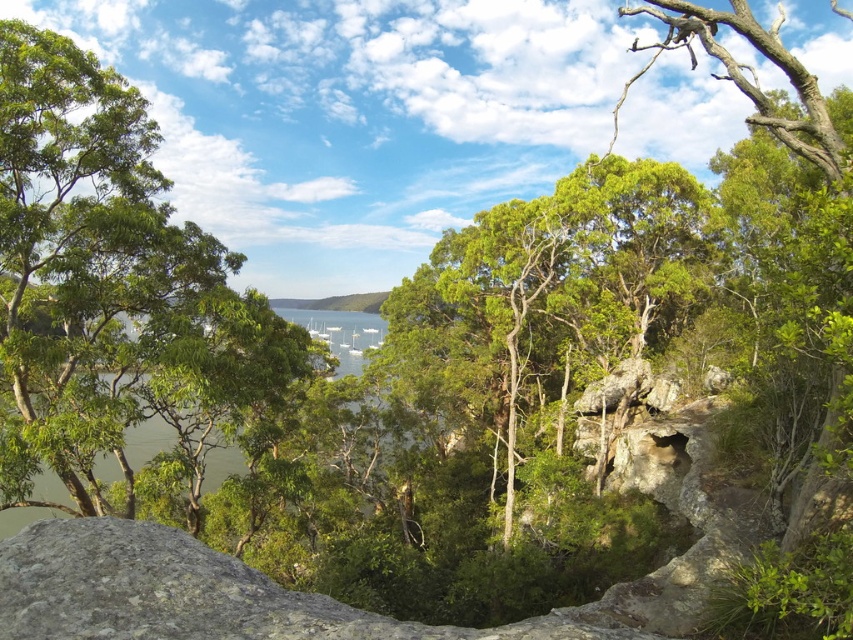
You are standing at the point labeled point (434, 324) and want to walk to the point labeled point (48, 483). Based on the scene description, will you be moving towards the foreground or the background?

You will be moving towards the background because point (434, 324) is closer to the viewer than point (48, 483), so moving from the closer point to the farther one means you are heading toward the background.

You are standing at the rocky vantage point looking down into the valley. You notice two points marked in the scene. Which of the two points, point (0, 429) or point (1, 525), is closer to your current position?

Point (0, 429) is closer to your current position because it is in front of point (1, 525).

You are a hiker standing at the rocky vantage point looking down into the valley. You notice a green leafy tree at center and green water at center. Which object is taller?

The green leafy tree at center is taller than the green water at center.